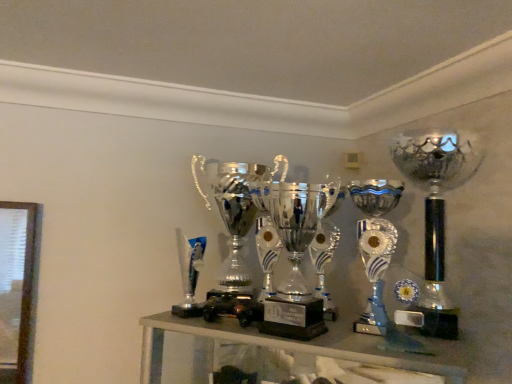
Question: Is polished silver trophy at center, positioned as the 1th trophy in left-to-right order, outside shiny silver trophy at center, which is the second trophy in left-to-right order?

Choices:
 (A) no
 (B) yes

Answer: (B)

Question: Can you confirm if polished silver trophy at center, positioned as the 1th trophy in left-to-right order, is shorter than shiny silver trophy at center, which is the second trophy in left-to-right order?

Choices:
 (A) no
 (B) yes

Answer: (A)

Question: Does polished silver trophy at center, which is the 3th trophy in right-to-left order, appear on the right side of shiny silver trophy at center, positioned as the 2th trophy in right-to-left order?

Choices:
 (A) no
 (B) yes

Answer: (A)

Question: Is polished silver trophy at center, which is the 3th trophy in right-to-left order, next to shiny silver trophy at center, which is the second trophy in left-to-right order?

Choices:
 (A) yes
 (B) no

Answer: (B)

Question: Is polished silver trophy at center, which is the 3th trophy in right-to-left order, thinner than shiny silver trophy at center, which is the second trophy in left-to-right order?

Choices:
 (A) no
 (B) yes

Answer: (A)

Question: From the image's perspective, is polished silver trophy at center, positioned as the 1th trophy in left-to-right order, located above shiny silver trophy at center, which is the second trophy in left-to-right order?

Choices:
 (A) yes
 (B) no

Answer: (A)

Question: From the image's perspective, is shiny silver trophy at center, which is the second trophy in left-to-right order, over polished silver trophy at center, which is the 3th trophy in right-to-left order?

Choices:
 (A) yes
 (B) no

Answer: (B)

Question: From a real-world perspective, is shiny silver trophy at center, positioned as the 2th trophy in right-to-left order, located higher than polished silver trophy at center, which is the 3th trophy in right-to-left order?

Choices:
 (A) yes
 (B) no

Answer: (B)

Question: From the image's perspective, is shiny silver trophy at center, positioned as the 2th trophy in right-to-left order, under polished silver trophy at center, which is the 3th trophy in right-to-left order?

Choices:
 (A) no
 (B) yes

Answer: (B)

Question: Does shiny silver trophy at center, which is the second trophy in left-to-right order, have a smaller size compared to polished silver trophy at center, which is the 3th trophy in right-to-left order?

Choices:
 (A) no
 (B) yes

Answer: (B)

Question: Considering the relative positions of shiny silver trophy at center, which is the second trophy in left-to-right order, and polished silver trophy at center, positioned as the 1th trophy in left-to-right order, in the image provided, is shiny silver trophy at center, which is the second trophy in left-to-right order, behind polished silver trophy at center, positioned as the 1th trophy in left-to-right order,?

Choices:
 (A) yes
 (B) no

Answer: (B)

Question: Is shiny silver trophy at center, positioned as the 2th trophy in right-to-left order, looking in the opposite direction of polished silver trophy at center, positioned as the 1th trophy in left-to-right order?

Choices:
 (A) yes
 (B) no

Answer: (B)

Question: Is silver/metallic trophy at right, acting as the 1th trophy starting from the right, wider than shiny silver trophy at center, which is the second trophy in left-to-right order?

Choices:
 (A) no
 (B) yes

Answer: (B)